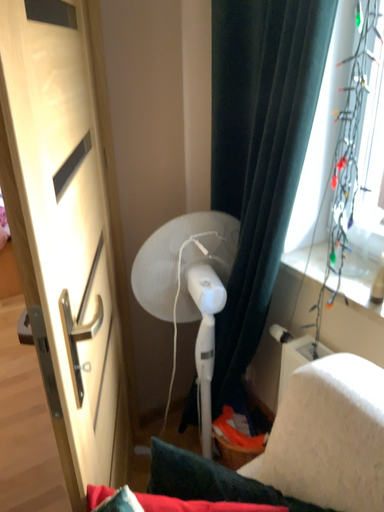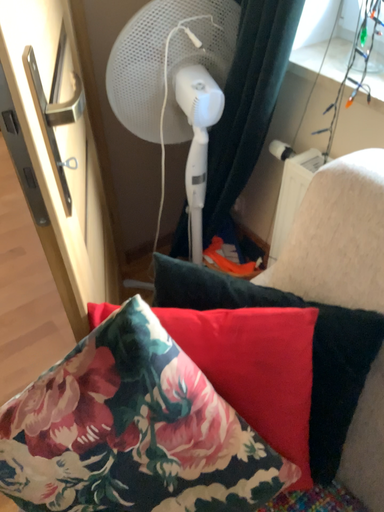
Question: How did the camera likely rotate when shooting the video?

Choices:
 (A) rotated upward
 (B) rotated downward

Answer: (B)